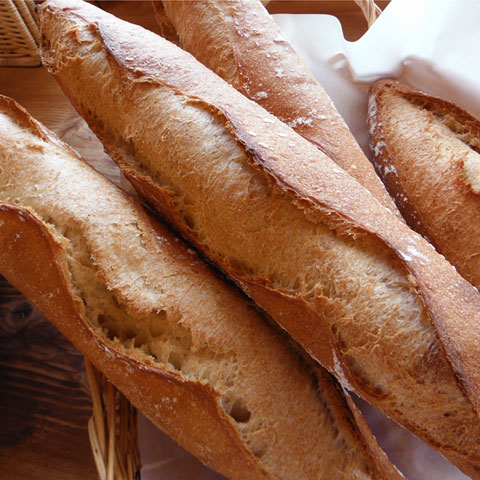
I want to click on wood grain, so click(52, 422), click(47, 398), click(52, 384), click(53, 365), click(19, 312).